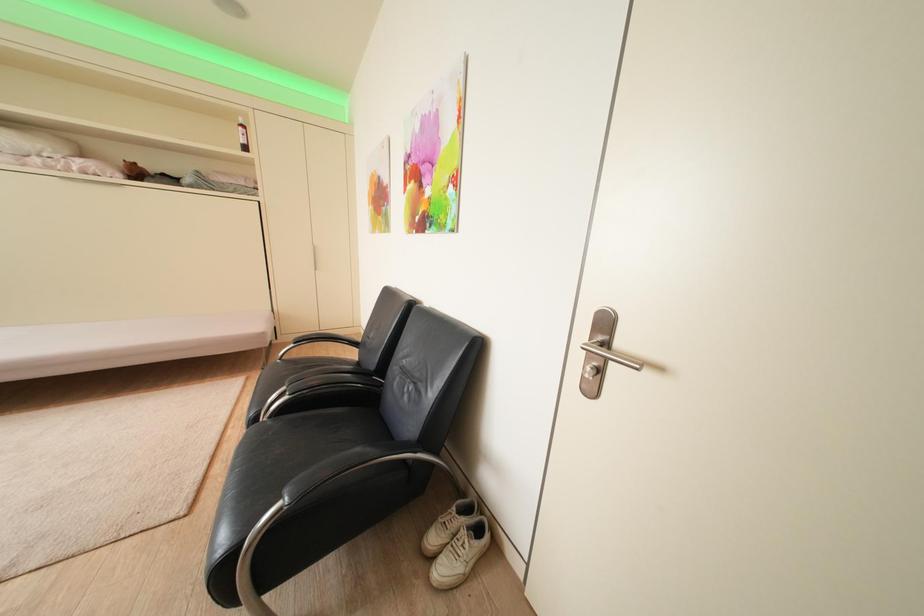
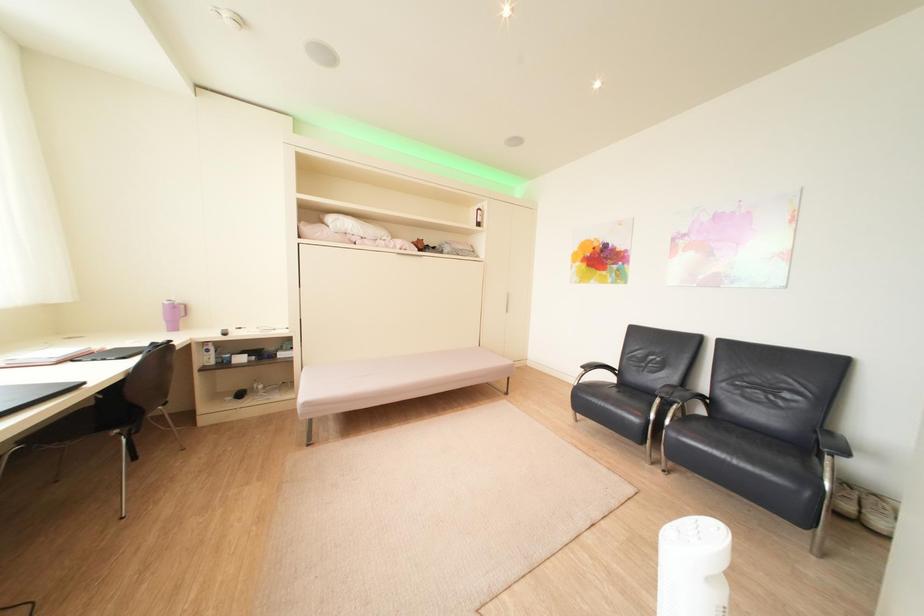
Question: In a continuous first-person perspective shot, in which direction is the camera moving?

Choices:
 (A) Left
 (B) Right
 (C) Forward
 (D) Backward

Answer: (A)